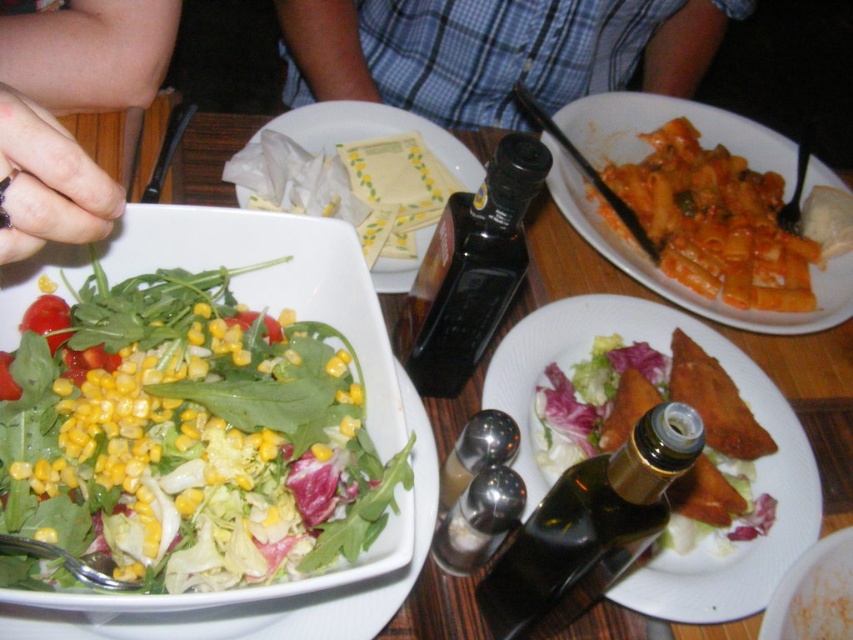
From the picture: You are sitting at the dining table and want to grab a fork from the point that is closer to you. Which point should you reach for, point (149, 385) or point (717, 340)?

Point (149, 385) is in front of point (717, 340), so you should reach for point (149, 385) as it is closer to you.

You are a server who needs to place a 12 inch long utensil set between the yellow paper napkins at center and the white matte bowl at center. Can the utensil set fit between them without overlapping either object?

The yellow paper napkins at center and white matte bowl at center are 18.64 inches apart from each other. Since the utensil set is 12 inches long, it can fit between them without overlapping either object because 12 inches is less than the 18.64 inch gap.